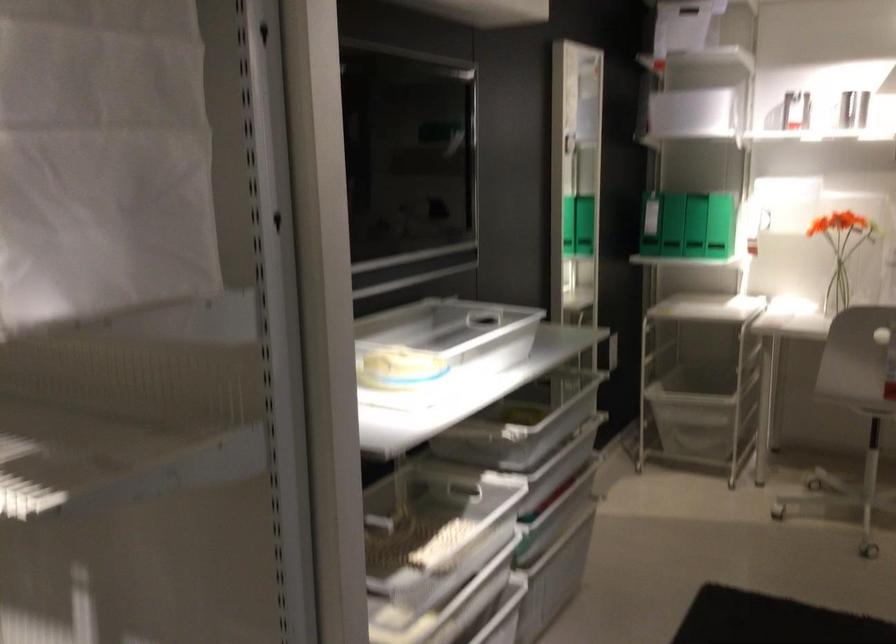
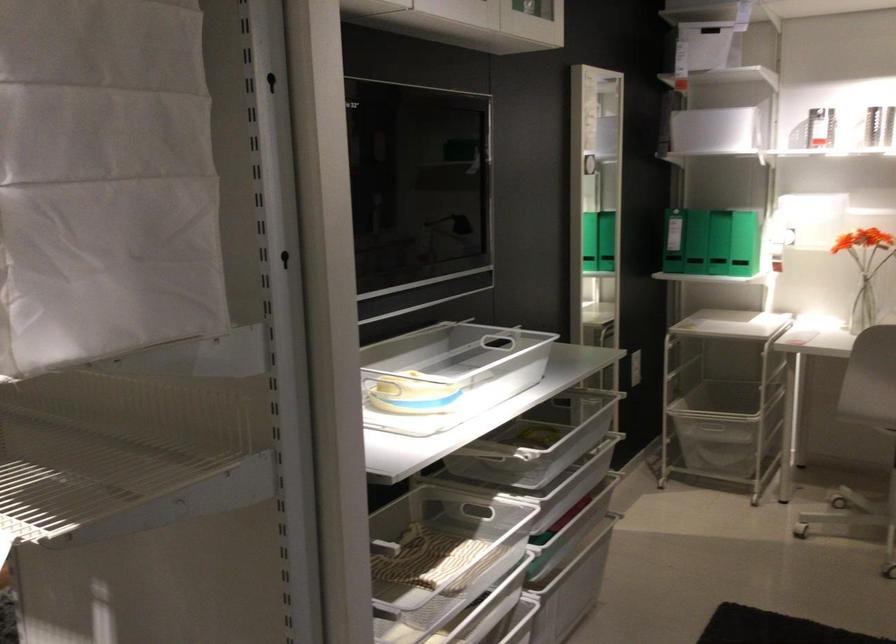
The point at (660, 220) is marked in the first image. Where is the corresponding point in the second image?

(673, 241)